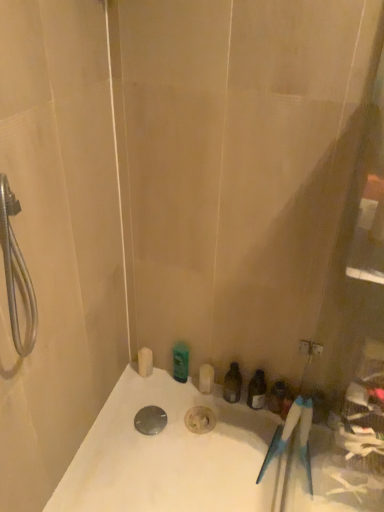
Where is `free space between translucent plastic bottle at center, which is the second toiletry in right-to-left order, and green matte bottle at upper center, the second toiletry in the left-to-right sequence`? free space between translucent plastic bottle at center, which is the second toiletry in right-to-left order, and green matte bottle at upper center, the second toiletry in the left-to-right sequence is located at coordinates (199, 393).